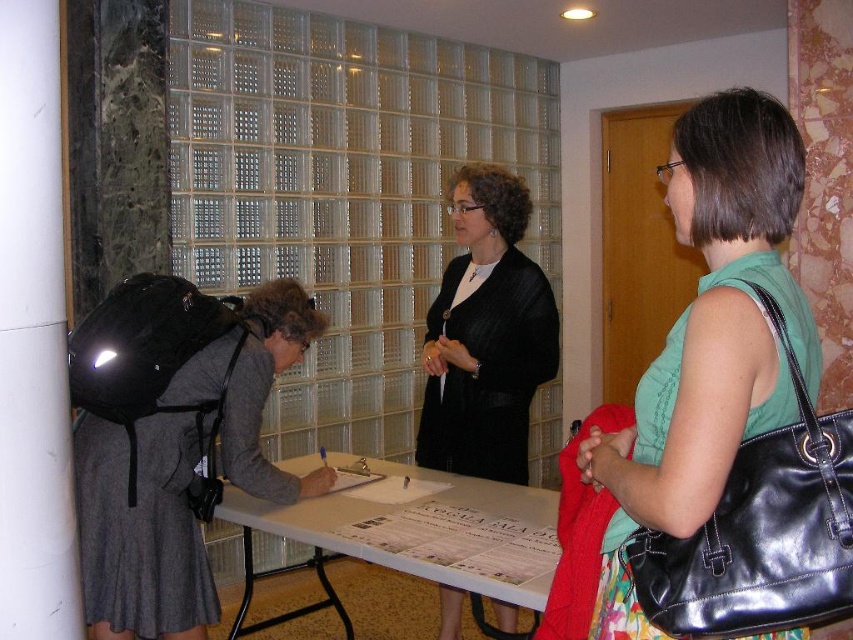
Is black textured blazer at center wider than white paper at center?

In fact, black textured blazer at center might be narrower than white paper at center.

Which is in front, point (473, 246) or point (500, 484)?

Point (500, 484) is in front.

At what (x,y) coordinates should I click in order to perform the action: click on black textured blazer at center. Please return your answer as a coordinate pair (x, y). The image size is (853, 640). Looking at the image, I should click on (486, 333).

Who is lower down, dark gray dress at left or white paper at center?

Positioned lower is white paper at center.

This screenshot has width=853, height=640. I want to click on dark gray dress at left, so click(175, 444).

Who is positioned more to the right, white smooth pillar at left or black textured blazer at center?

black textured blazer at center

Is point (22, 333) positioned behind point (527, 346)?

No, it is in front of (527, 346).

Is point (15, 426) less distant than point (514, 237)?

Yes, point (15, 426) is in front of point (514, 237).

This screenshot has height=640, width=853. Identify the location of white smooth pillar at left. (33, 337).